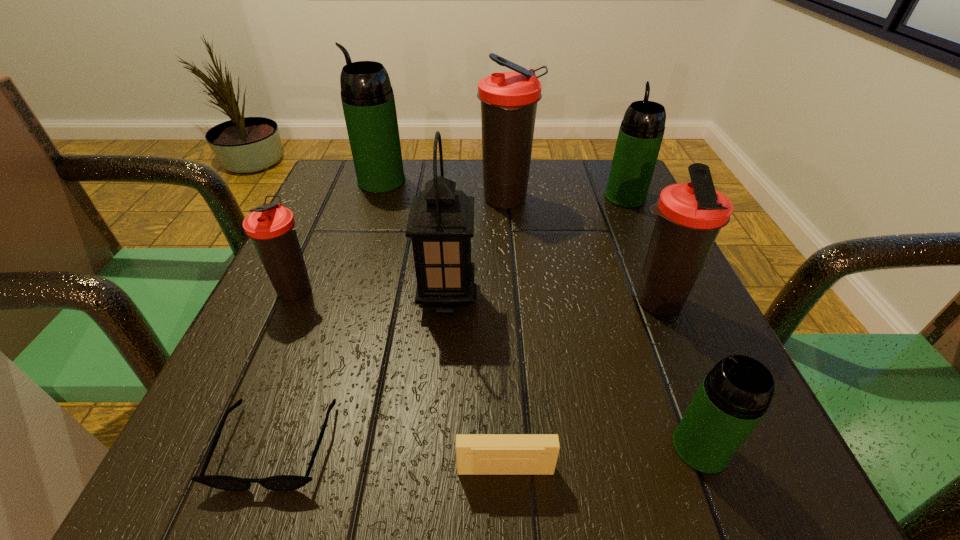
This screenshot has width=960, height=540. Identify the location of vacant point located between the shortest object and the lantern. (362, 371).

Image resolution: width=960 pixels, height=540 pixels. Find the location of `vacant region between the smallest green thermos bottle and the second smallest green thermos bottle`. vacant region between the smallest green thermos bottle and the second smallest green thermos bottle is located at coordinates (662, 322).

In order to click on empty space that is in between the smallest brown thermos bottle and the lantern in this screenshot , I will do `click(372, 294)`.

I want to click on vacant area that lies between the smallest brown thermos bottle and the biggest green thermos bottle, so click(x=340, y=235).

You are a GUI agent. You are given a task and a screenshot of the screen. Output one action in this format:
    pyautogui.click(x=<x>, y=<y>)
    Task: Click on the blank region between the leftmost green thermos bottle and the nearest green thermos bottle
    Image resolution: width=960 pixels, height=540 pixels.
    Given the screenshot: What is the action you would take?
    pyautogui.click(x=540, y=314)

This screenshot has height=540, width=960. In order to click on empty location between the sunglasses and the rightmost brown thermos bottle in this screenshot , I will do `click(467, 374)`.

The height and width of the screenshot is (540, 960). What are the coordinates of `blank region between the second biggest brown thermos bottle and the eighth tallest object` in the screenshot? It's located at (581, 386).

Identify which object is the third closest to the second smallest green thermos bottle. Please provide its 2D coordinates. Your answer should be formatted as a tuple, i.e. [(x, y)], where the tuple contains the x and y coordinates of a point satisfying the conditions above.

[(441, 221)]

Find the location of a particular element. object that is the second nearest to the sunglasses is located at coordinates (441, 221).

At what (x,y) coordinates should I click in order to perform the action: click on the closest thermos bottle relative to the farthest brown thermos bottle. Please return your answer as a coordinate pair (x, y). This screenshot has width=960, height=540. Looking at the image, I should click on (641, 132).